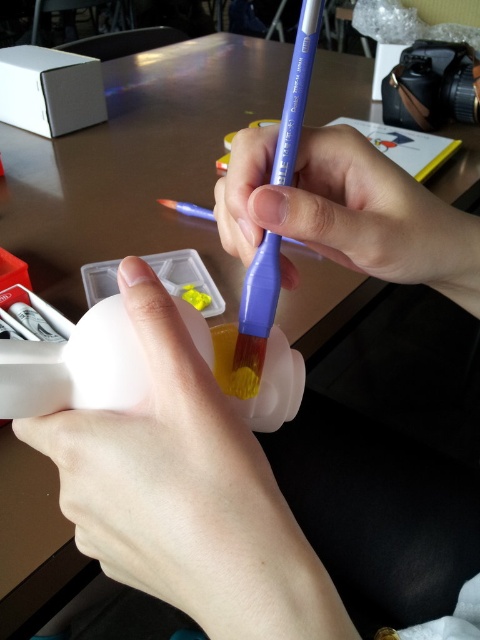
Question: Among these objects, which one is nearest to the camera?

Choices:
 (A) purple plastic paint brush at center
 (B) white matte paintbrush at center
 (C) purple plastic toothbrush at upper center

Answer: (B)

Question: Is purple plastic toothbrush at upper center in front of white matte paintbrush at center?

Choices:
 (A) yes
 (B) no

Answer: (B)

Question: Which object is the farthest from the purple plastic paint brush at center?

Choices:
 (A) white matte paintbrush at center
 (B) purple plastic toothbrush at upper center

Answer: (A)

Question: Is purple plastic toothbrush at upper center wider than white matte paintbrush at center?

Choices:
 (A) yes
 (B) no

Answer: (A)

Question: Is white matte paintbrush at center closer to camera compared to purple plastic paint brush at center?

Choices:
 (A) yes
 (B) no

Answer: (A)

Question: Which object is the closest to the white matte paintbrush at center?

Choices:
 (A) purple plastic toothbrush at upper center
 (B) purple plastic paint brush at center

Answer: (B)